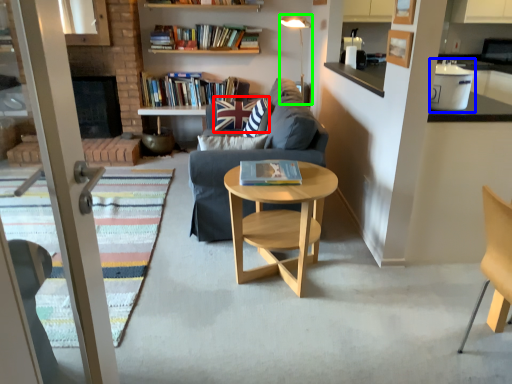
Question: Which object is positioned farthest from pillow (highlighted by a red box)? Select from appliance (highlighted by a blue box) and lamp (highlighted by a green box).

Choices:
 (A) appliance
 (B) lamp

Answer: (A)